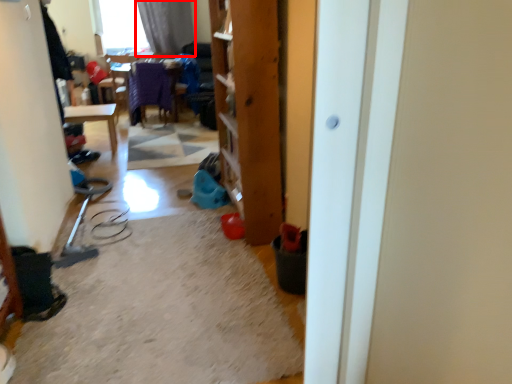
Question: From the image, what is the correct spatial relationship of curtain (annotated by the red box) in relation to screen door?

Choices:
 (A) right
 (B) left

Answer: (B)